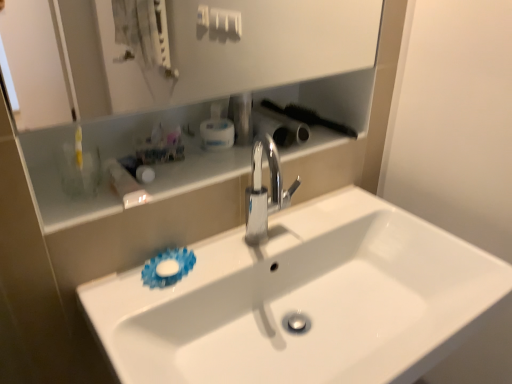
Identify the location of free space above white glossy shelf at upper center (from a real-world perspective). (179, 169).